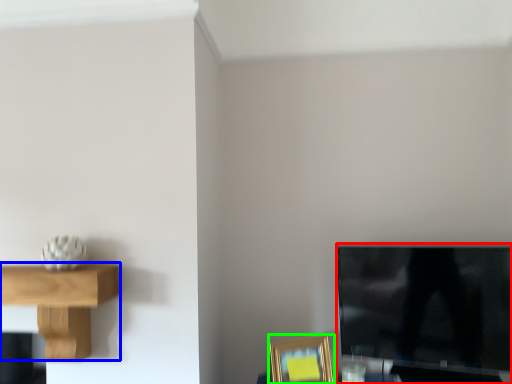
Question: Which is nearer to the television (highlighted by a red box)? shelf (highlighted by a blue box) or picture frame (highlighted by a green box).

Choices:
 (A) shelf
 (B) picture frame

Answer: (B)